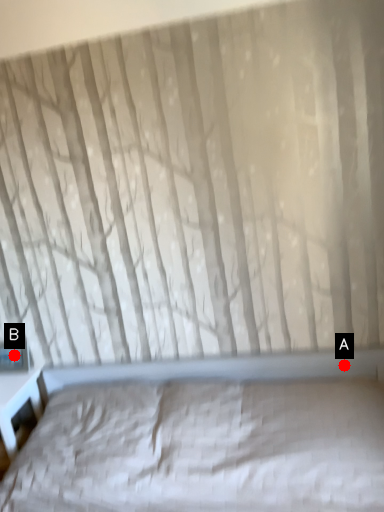
Question: Two points are circled on the image, labeled by A and B beside each circle. Which point is farther to the camera?

Choices:
 (A) A is further
 (B) B is further

Answer: (B)